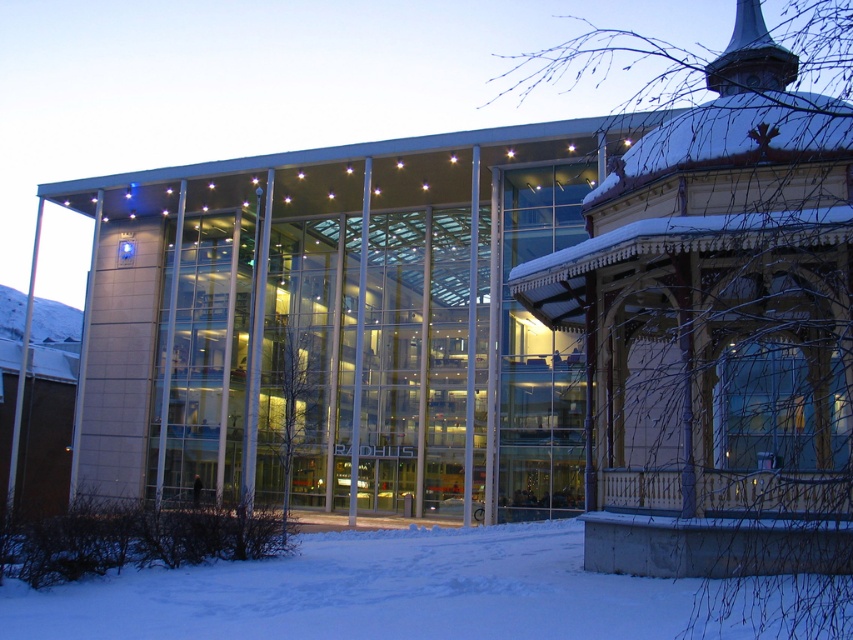
You are a photographer planning to capture the modern building and its surroundings. You want to ensure that both the wooden gazebo at right and the white powdery snow at lower left are clearly visible in your shot. Considering their sizes, which object might require you to adjust your camera angle to include it fully in the frame?

The wooden gazebo at right is thinner than the white powdery snow at lower left. Since the wooden gazebo at right is thinner, it might require adjusting the camera angle to ensure it is fully captured in the frame compared to the wider white powdery snow at lower left.

Based on the photo, you are standing at the entrance of the modern building and want to walk to the wooden gazebo at right. Which direction should you walk to avoid stepping on the white powdery snow at lower left?

You should walk towards the wooden gazebo at right without stepping on the white powdery snow at lower left since the wooden gazebo at right is positioned over the snow, so the path might be clear there.

You are planning to place a new bench in the scene. The bench must be placed between the wooden gazebo at right and the white powdery snow at lower left. Which object should the bench be closer to if it needs to be near the larger object?

The wooden gazebo at right is larger in size than the white powdery snow at lower left, so the bench should be placed closer to the wooden gazebo at right.